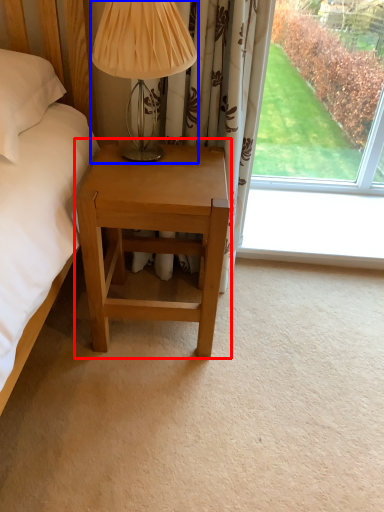
Question: Which object is further to the camera taking this photo, nightstand (highlighted by a red box) or table lamp (highlighted by a blue box)?

Choices:
 (A) nightstand
 (B) table lamp

Answer: (A)